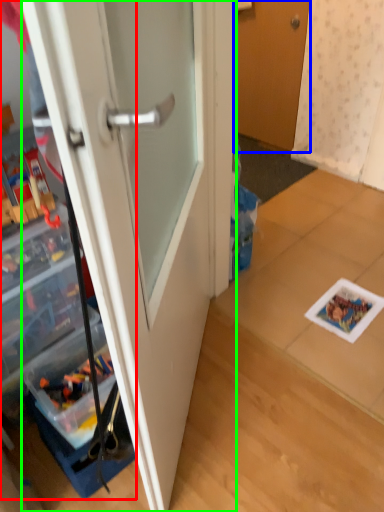
Question: Considering the real-world distances, which object is farthest from cabinetry (highlighted by a red box)? door (highlighted by a blue box) or door (highlighted by a green box)?

Choices:
 (A) door
 (B) door

Answer: (A)